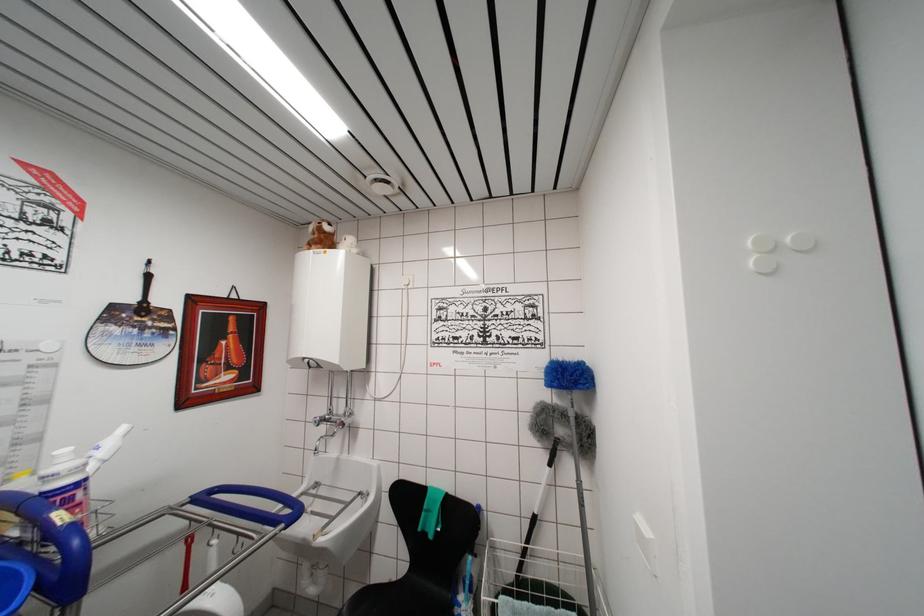
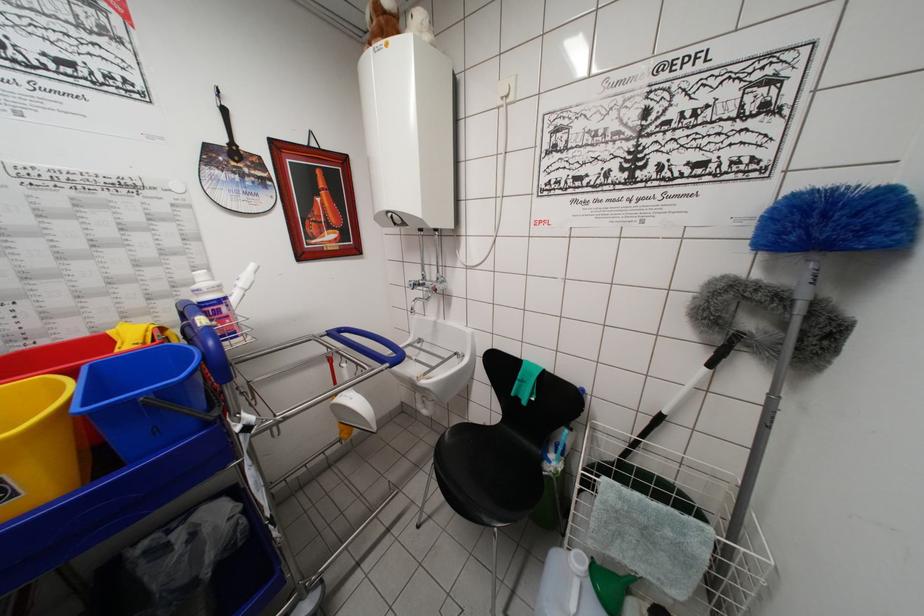
Where in the second image is the point corresponding to [333,428] from the first image?

(428, 294)